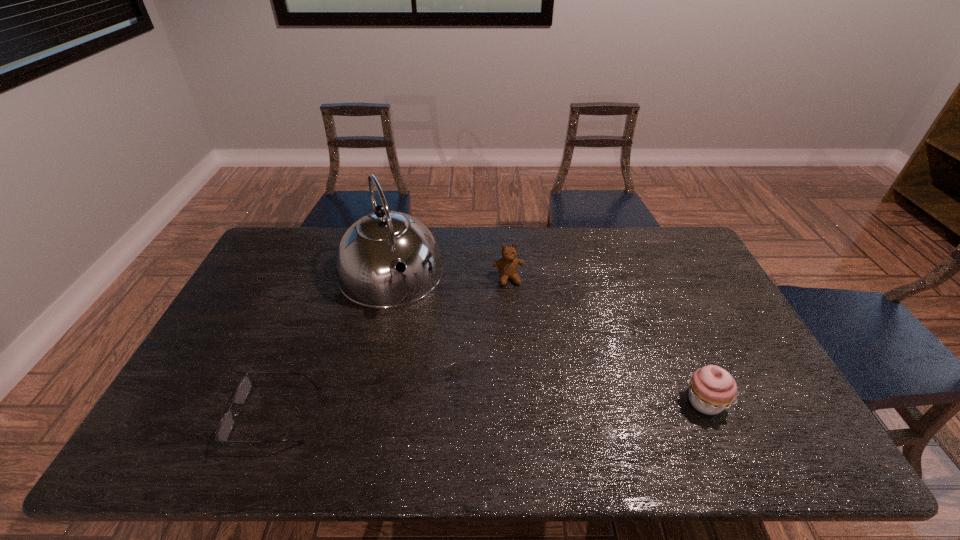
Locate an element on the screen. The height and width of the screenshot is (540, 960). free space at the near edge is located at coordinates (301, 402).

Find the location of `vacant space at the left edge`. vacant space at the left edge is located at coordinates (265, 320).

The width and height of the screenshot is (960, 540). I want to click on vacant region at the right edge, so click(687, 319).

Where is `free space at the far right corner`? free space at the far right corner is located at coordinates (671, 247).

The height and width of the screenshot is (540, 960). In the image, there is a desktop. Identify the location of vacant region at the near right corner. (751, 408).

Locate an element on the screen. Image resolution: width=960 pixels, height=540 pixels. free point between the kettle and the rightmost object is located at coordinates click(x=547, y=338).

This screenshot has height=540, width=960. Find the location of `free spot between the teddy bear and the rightmost object`. free spot between the teddy bear and the rightmost object is located at coordinates (607, 340).

Where is `free spot between the tallest object and the cupcake`? The image size is (960, 540). free spot between the tallest object and the cupcake is located at coordinates (547, 338).

You are a GUI agent. You are given a task and a screenshot of the screen. Output one action in this format:
    pyautogui.click(x=<x>, y=<y>)
    Task: Click on the empty location between the cupcake and the teddy bear
    This screenshot has height=540, width=960.
    Given the screenshot: What is the action you would take?
    pyautogui.click(x=607, y=340)

Locate an element on the screen. vacant space in between the tallest object and the second object from right to left is located at coordinates point(449,276).